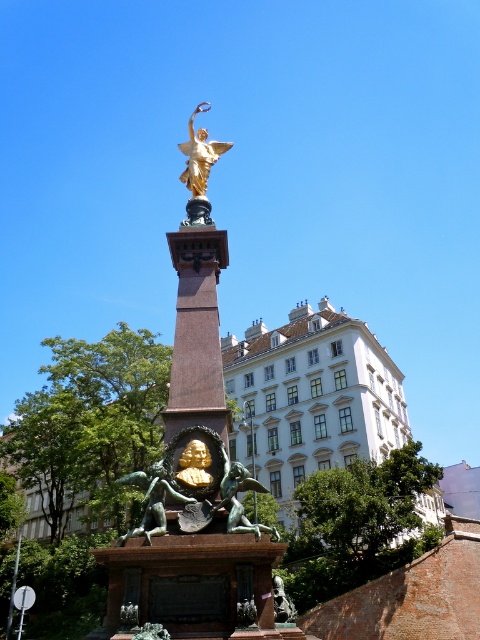
Image resolution: width=480 pixels, height=640 pixels. What are the coordinates of `gold polished statue at center` in the screenshot? It's located at (194, 486).

Who is higher up, gold polished statue at center or bronze/green patina statue at center?

Positioned higher is gold polished statue at center.

Is point (219, 428) farther from viewer compared to point (158, 468)?

Yes, point (219, 428) is behind point (158, 468).

Identify the location of gold polished statue at center. (194, 486).

Does gold polished statue at center have a greater width compared to bronze statue at center?

Yes.

What do you see at coordinates (194, 486) in the screenshot? I see `gold polished statue at center` at bounding box center [194, 486].

Between point (187, 488) and point (252, 483), which one is positioned in front?

Point (187, 488) is in front.

At what (x,y) coordinates should I click in order to perform the action: click on gold polished statue at center. Please return your answer as a coordinate pair (x, y). Looking at the image, I should click on (194, 486).

Can you confirm if bronze/green patina statue at center is wider than bronze statue at center?

Incorrect, bronze/green patina statue at center's width does not surpass bronze statue at center's.

Does bronze/green patina statue at center have a greater height compared to bronze statue at center?

Incorrect, bronze/green patina statue at center's height is not larger of bronze statue at center's.

Is point (147, 506) farther from camera compared to point (237, 483)?

No.

Locate an element on the screen. bronze/green patina statue at center is located at coordinates pyautogui.click(x=152, y=500).